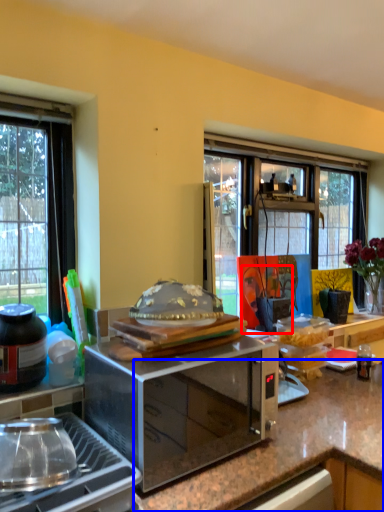
Question: Which point is closer to the camera, person (highlighted by a red box) or countertop (highlighted by a blue box)?

Choices:
 (A) person
 (B) countertop

Answer: (B)